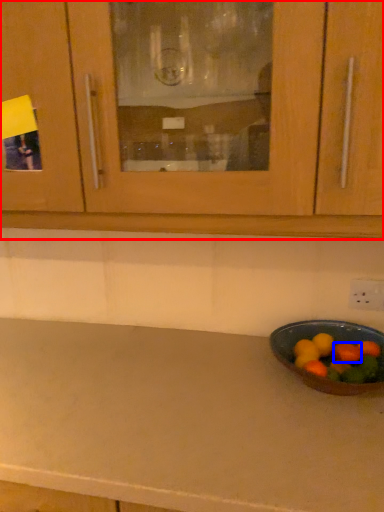
Question: Which of the following is the closest to the observer, cabinetry (highlighted by a red box) or fruit (highlighted by a blue box)?

Choices:
 (A) cabinetry
 (B) fruit

Answer: (A)